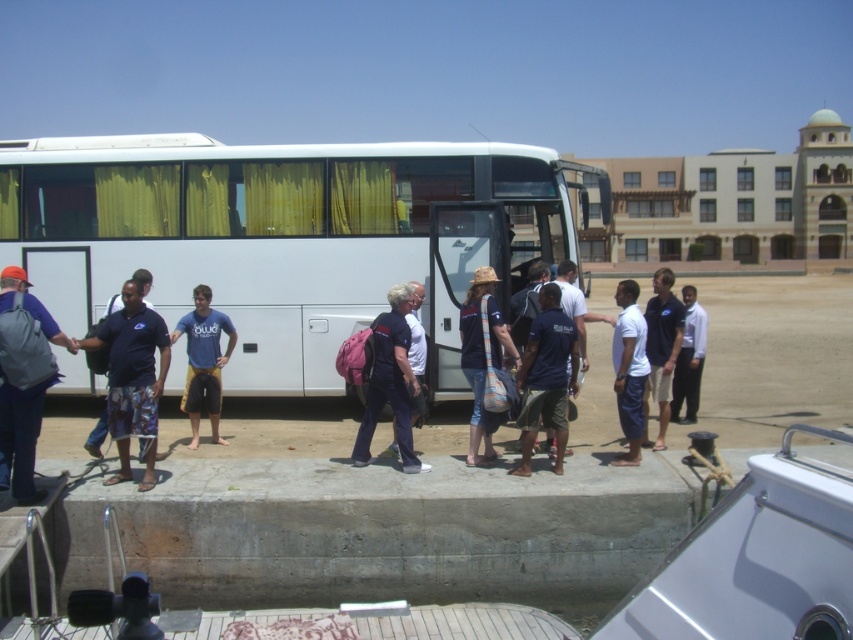
Looking at this image, which is above, dark blue fabric shirt at center or white shirt at center?

white shirt at center is above.

Can you confirm if dark blue fabric shirt at center is positioned below white shirt at center?

Indeed, dark blue fabric shirt at center is positioned under white shirt at center.

Is point (564, 394) closer to camera compared to point (703, 349)?

That is True.

In order to click on dark blue fabric shirt at center in this screenshot , I will do `click(546, 378)`.

Between blue printed shirt at left and dark blue fabric shirt at center, which one is positioned higher?

blue printed shirt at left

Does point (154, 460) lie in front of point (548, 312)?

That is True.

Who is more forward, (154, 312) or (532, 330)?

Point (154, 312) is more forward.

The image size is (853, 640). I want to click on blue printed shirt at left, so click(x=132, y=376).

Consider the image. Does matte blue backpack at left come behind blue printed shirt at left?

No, it is in front of blue printed shirt at left.

Is point (42, 314) closer to camera compared to point (119, 310)?

That is True.

Who is more distant from viewer, (26, 372) or (138, 385)?

Point (138, 385)

At what (x,y) coordinates should I click in order to perform the action: click on matte blue backpack at left. Please return your answer as a coordinate pair (x, y). The height and width of the screenshot is (640, 853). Looking at the image, I should click on (22, 380).